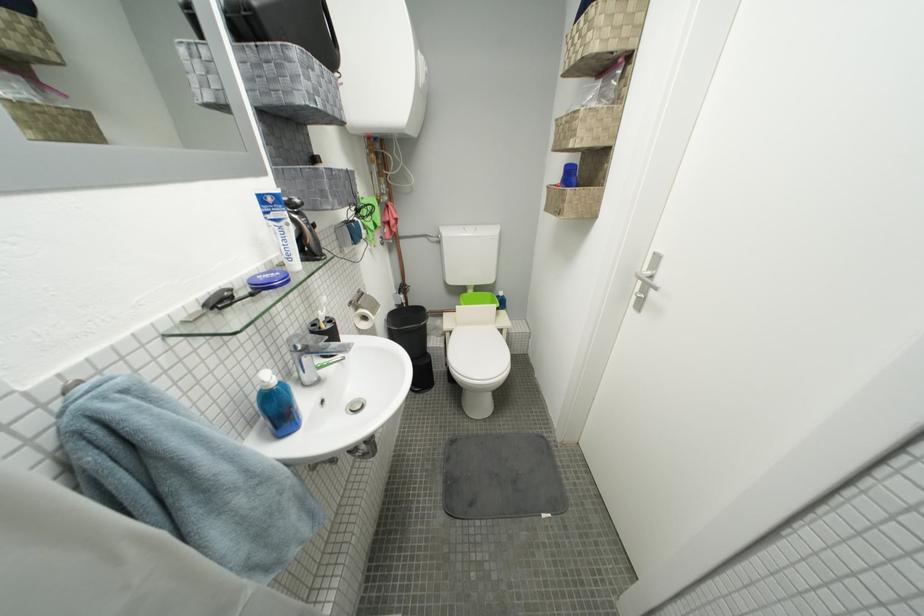
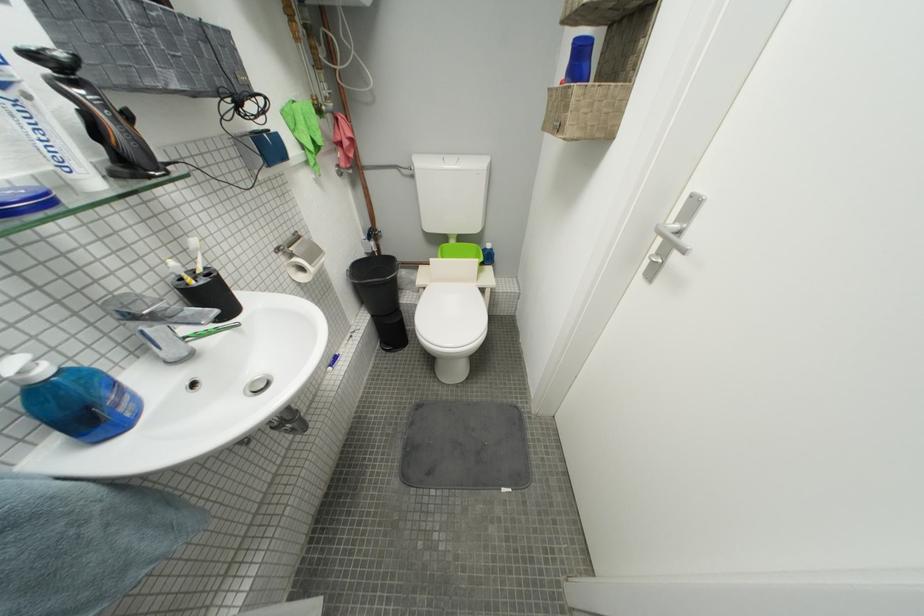
Where in the second image is the point corresponding to pixel 305 357 from the first image?

(139, 325)